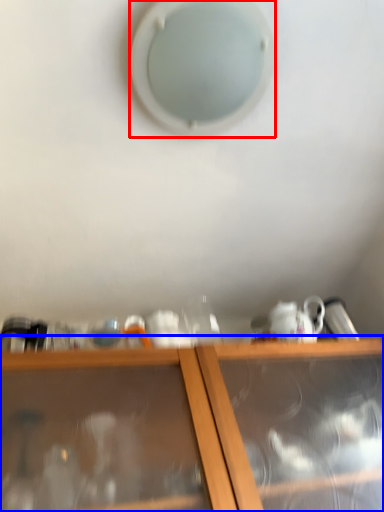
Question: Which object appears farthest to the camera in this image, hole (highlighted by a red box) or shelf (highlighted by a blue box)?

Choices:
 (A) hole
 (B) shelf

Answer: (A)